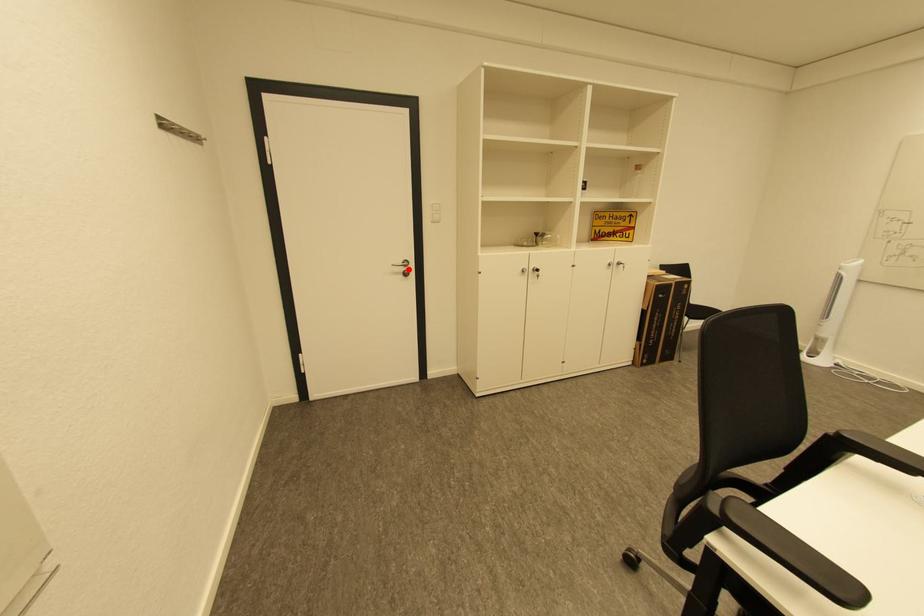
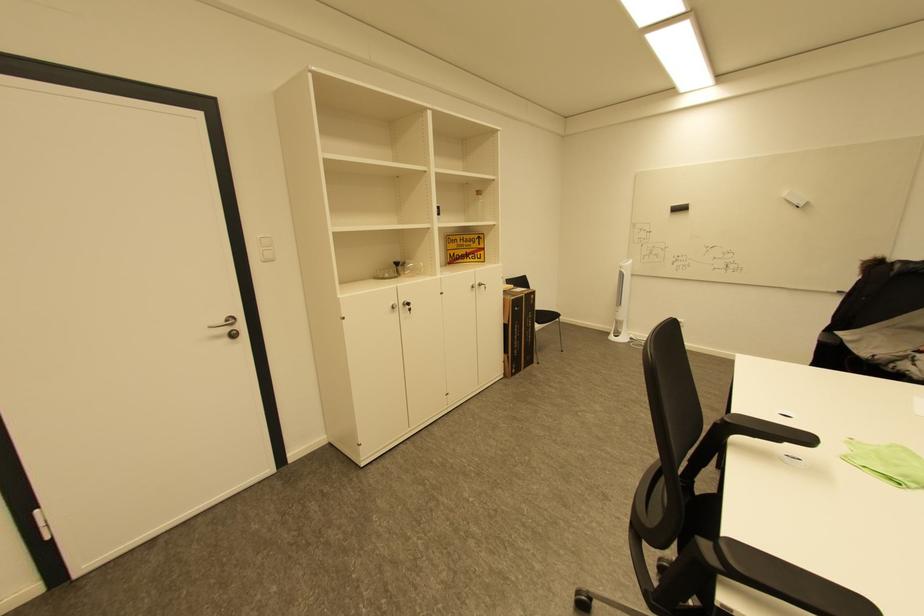
Find the pixel in the second image that matches the highlighted location in the first image.

(233, 330)